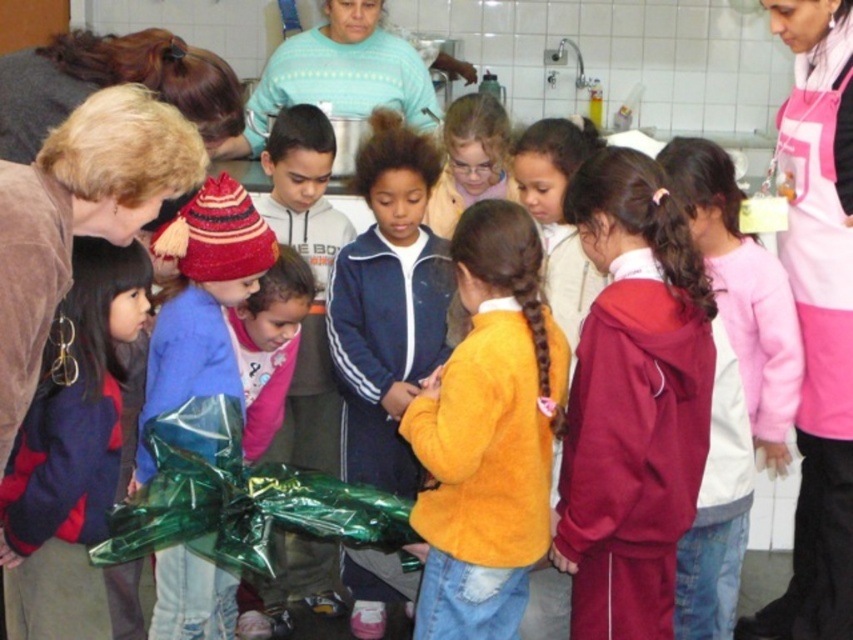
You are a photographer standing in the kitchen scene. You want to take a photo of both the orange fuzzy sweater at center and the shiny green wrapping paper at center. Can you see both objects clearly in the same frame?

The orange fuzzy sweater at center is in front of the shiny green wrapping paper at center, so the sweater may block part of the wrapping paper in the photo. To ensure both are visible, adjust the camera angle to capture both without obstruction.